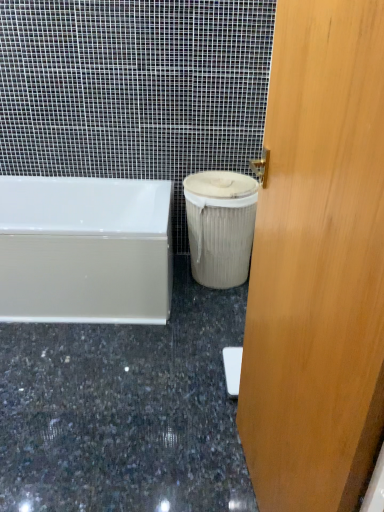
Question: From the image's perspective, is granite at lower center located beneath white glossy bathtub at lower left?

Choices:
 (A) yes
 (B) no

Answer: (A)

Question: Can you confirm if granite at lower center is positioned to the left of white glossy bathtub at lower left?

Choices:
 (A) no
 (B) yes

Answer: (A)

Question: From a real-world perspective, is granite at lower center positioned under white glossy bathtub at lower left based on gravity?

Choices:
 (A) no
 (B) yes

Answer: (B)

Question: Is granite at lower center further to camera compared to white glossy bathtub at lower left?

Choices:
 (A) no
 (B) yes

Answer: (A)

Question: Is granite at lower center positioned with its back to white glossy bathtub at lower left?

Choices:
 (A) yes
 (B) no

Answer: (B)

Question: Relative to granite at lower center, is wooden door at center in front or behind?

Choices:
 (A) front
 (B) behind

Answer: (A)

Question: Considering the positions of point (324, 323) and point (110, 396), is point (324, 323) closer or farther from the camera than point (110, 396)?

Choices:
 (A) closer
 (B) farther

Answer: (A)

Question: From their relative heights in the image, would you say wooden door at center is taller or shorter than granite at lower center?

Choices:
 (A) tall
 (B) short

Answer: (A)

Question: From the image's perspective, is wooden door at center above or below granite at lower center?

Choices:
 (A) below
 (B) above

Answer: (B)

Question: Based on their positions, is granite at lower center located to the left or right of white glossy bathtub at lower left?

Choices:
 (A) left
 (B) right

Answer: (B)

Question: Is granite at lower center in front of or behind white glossy bathtub at lower left in the image?

Choices:
 (A) behind
 (B) front

Answer: (B)

Question: Considering the positions of granite at lower center and white glossy bathtub at lower left in the image, is granite at lower center taller or shorter than white glossy bathtub at lower left?

Choices:
 (A) tall
 (B) short

Answer: (B)

Question: Based on their sizes in the image, would you say granite at lower center is bigger or smaller than white glossy bathtub at lower left?

Choices:
 (A) big
 (B) small

Answer: (B)

Question: From a real-world perspective, is white glossy bathtub at lower left above or below wooden door at center?

Choices:
 (A) below
 (B) above

Answer: (A)

Question: From the image's perspective, is white glossy bathtub at lower left above or below wooden door at center?

Choices:
 (A) below
 (B) above

Answer: (B)